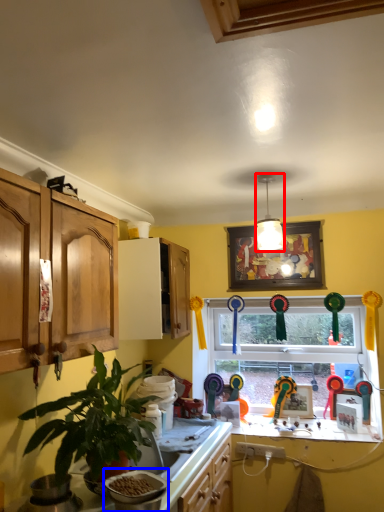
Question: Which object is further to the camera taking this photo, light fixture (highlighted by a red box) or appliance (highlighted by a blue box)?

Choices:
 (A) light fixture
 (B) appliance

Answer: (A)